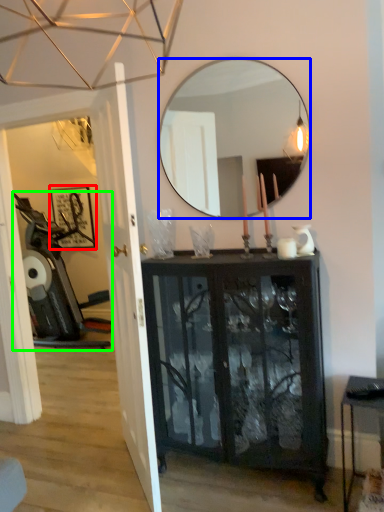
Question: Which object is positioned farthest from picture frame (highlighted by a red box)? Select from mirror (highlighted by a blue box) and swivel chair (highlighted by a green box).

Choices:
 (A) mirror
 (B) swivel chair

Answer: (A)